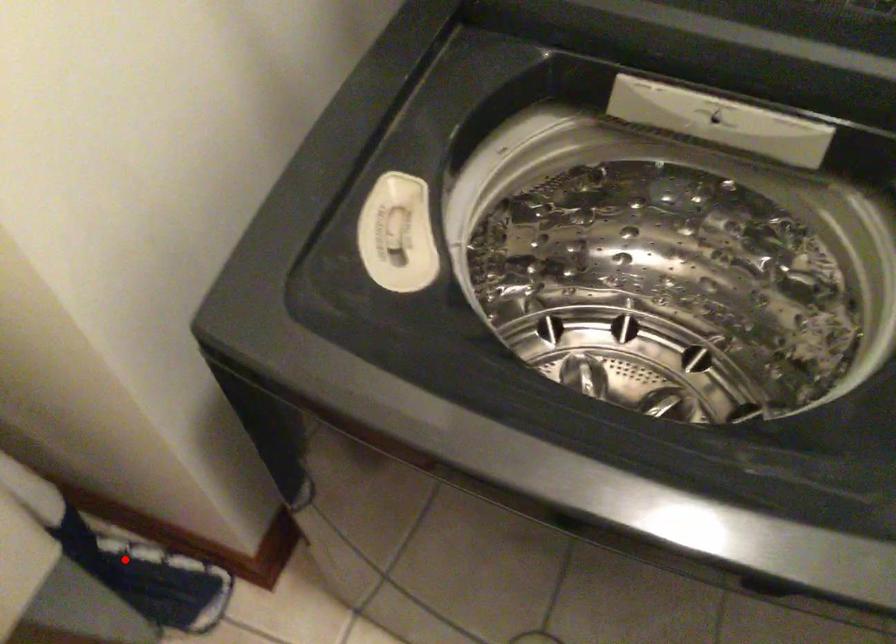
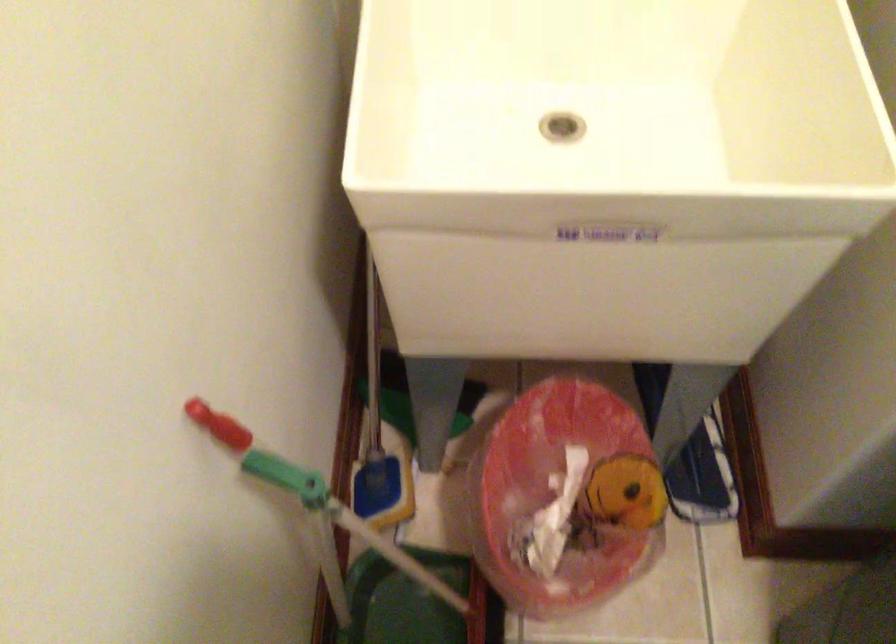
Question: I am providing you with two images of the same scene from different viewpoints. A red point is marked on the first image. Is the red point's position out of view in image 2?

Choices:
 (A) Yes
 (B) No

Answer: (A)